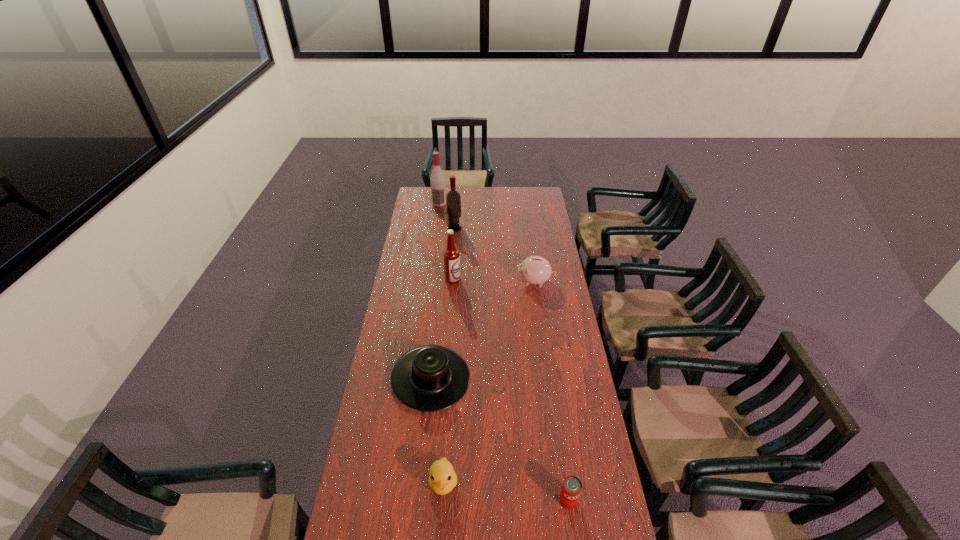
Locate an element on the screen. vacant space located on the label side of the nearest alcohol is located at coordinates (492, 279).

Locate an element on the screen. The width and height of the screenshot is (960, 540). free region located on the back of the piggy bank is located at coordinates (528, 232).

Identify the location of vacant area located 0.110m on the face of the duck. The image size is (960, 540). (440, 539).

You are a GUI agent. You are given a task and a screenshot of the screen. Output one action in this format:
    pyautogui.click(x=<x>, y=<y>)
    Task: Click on the vacant area located 0.190m on the right of the dress hat
    The image size is (960, 540).
    Given the screenshot: What is the action you would take?
    pyautogui.click(x=516, y=378)

Find the location of a particular element. This screenshot has height=540, width=960. vacant area situated on the front of the can is located at coordinates pos(574,539).

I want to click on object that is at the far edge, so click(x=437, y=180).

Where is `alcohol located in the left edge section of the desktop`? This screenshot has width=960, height=540. alcohol located in the left edge section of the desktop is located at coordinates (437, 180).

The image size is (960, 540). I want to click on dress hat at the left edge, so click(x=429, y=378).

Locate an element on the screen. Image resolution: width=960 pixels, height=540 pixels. piggy bank positioned at the right edge is located at coordinates (535, 270).

Where is `can that is at the right edge`? The height and width of the screenshot is (540, 960). can that is at the right edge is located at coordinates (571, 488).